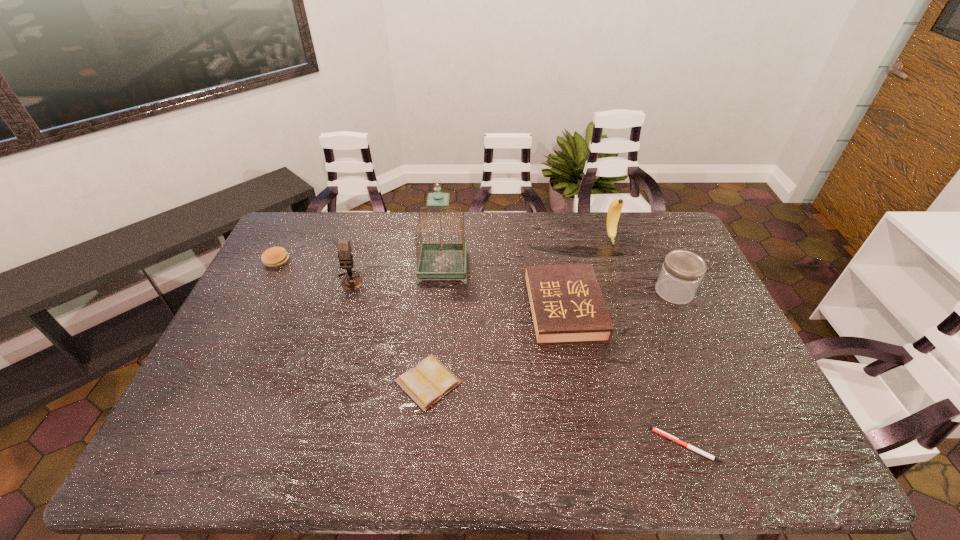
The height and width of the screenshot is (540, 960). What are the coordinates of `the second shortest object` in the screenshot? It's located at (426, 383).

The width and height of the screenshot is (960, 540). Find the location of `pen`. pen is located at coordinates (656, 430).

This screenshot has width=960, height=540. I want to click on the nearest object, so click(x=656, y=430).

Locate an element on the screen. vacant space located at the door of the tallest object is located at coordinates (506, 268).

Where is `free point located from the stem of the farthest object`? The height and width of the screenshot is (540, 960). free point located from the stem of the farthest object is located at coordinates [631, 296].

You are a GUI agent. You are given a task and a screenshot of the screen. Output one action in this format:
    pyautogui.click(x=<x>, y=<y>)
    Task: Click on the free space located on the front-facing side of the microphone
    
    Given the screenshot: What is the action you would take?
    pyautogui.click(x=322, y=374)

At what (x,y) coordinates should I click in order to perform the action: click on vacant position located on the left of the rightmost object. Please return your answer as a coordinate pair (x, y). This screenshot has width=960, height=540. Looking at the image, I should click on (534, 292).

You are a GUI agent. You are given a task and a screenshot of the screen. Output one action in this format:
    pyautogui.click(x=<x>, y=<y>)
    Task: Click on the vacant space located 0.150m on the left of the fifth object from left to right
    Image resolution: width=960 pixels, height=540 pixels.
    Given the screenshot: What is the action you would take?
    pyautogui.click(x=479, y=309)

Identify the location of vacant region located 0.290m on the right of the sixth tallest object. The width and height of the screenshot is (960, 540). [373, 261].

Find the location of a particular element. vacant space located 0.070m on the right of the second shortest object is located at coordinates (489, 382).